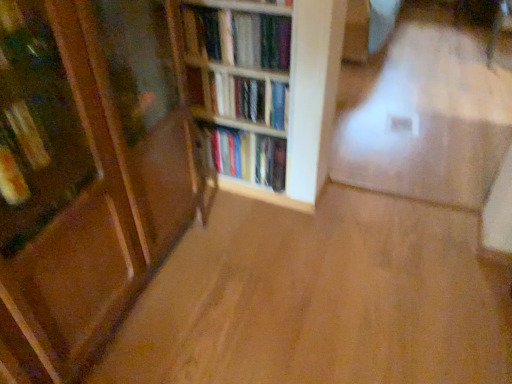
The height and width of the screenshot is (384, 512). What are the coordinates of `wooden bookshelf at center, which ranks as the first book in top-to-bottom order` in the screenshot? It's located at (238, 37).

What do you see at coordinates (267, 86) in the screenshot? The height and width of the screenshot is (384, 512). I see `wooden bookshelf at center` at bounding box center [267, 86].

Describe the element at coordinates (425, 112) in the screenshot. I see `white glossy wall at upper center` at that location.

Find the location of `wooden bookshelf at center, which ranks as the first book in top-to-bottom order`. wooden bookshelf at center, which ranks as the first book in top-to-bottom order is located at coordinates (238, 37).

Between wooden bookshelf at center, marked as the third book in a bottom-to-top arrangement, and wooden bookshelf at center, which one has larger width?

wooden bookshelf at center, marked as the third book in a bottom-to-top arrangement, is wider.

Is wooden bookshelf at center, which ranks as the first book in top-to-bottom order, smaller than wooden bookshelf at center?

Correct, wooden bookshelf at center, which ranks as the first book in top-to-bottom order, occupies less space than wooden bookshelf at center.

Is wooden bookshelf at center, marked as the third book in a bottom-to-top arrangement, facing away from wooden bookshelf at center?

Absolutely, wooden bookshelf at center, marked as the third book in a bottom-to-top arrangement, is directed away from wooden bookshelf at center.

Does point (202, 36) come behind point (185, 16)?

Yes, point (202, 36) is farther from viewer.

Based on the photo, considering the sizes of objects white glossy wall at upper center and wooden bookshelf at center, marked as the third book in a bottom-to-top arrangement, in the image provided, who is bigger, white glossy wall at upper center or wooden bookshelf at center, marked as the third book in a bottom-to-top arrangement,?

white glossy wall at upper center is bigger.

Is white glossy wall at upper center closer to the viewer compared to wooden bookshelf at center, which ranks as the first book in top-to-bottom order?

No, the depth of white glossy wall at upper center is greater than that of wooden bookshelf at center, which ranks as the first book in top-to-bottom order.

Can you confirm if white glossy wall at upper center is shorter than wooden bookshelf at center, which ranks as the first book in top-to-bottom order?

Indeed, white glossy wall at upper center has a lesser height compared to wooden bookshelf at center, which ranks as the first book in top-to-bottom order.

Is there a large distance between white glossy wall at upper center and wooden bookshelf at center, marked as the third book in a bottom-to-top arrangement?

Indeed, white glossy wall at upper center is not near wooden bookshelf at center, marked as the third book in a bottom-to-top arrangement.

Locate an element on the screen. This screenshot has height=384, width=512. book behind the hardcover books at center, the second book in the top-to-bottom sequence is located at coordinates (246, 156).

Is the depth of hardcover books at center, the second book in the top-to-bottom sequence, greater than that of hardcover books at center, the first book in the bottom-to-top sequence?

That is False.

Between hardcover books at center, the second book in the bottom-to-top sequence, and hardcover books at center, which is counted as the third book, starting from the top, which one appears on the left side from the viewer's perspective?

From the viewer's perspective, hardcover books at center, the second book in the bottom-to-top sequence, appears more on the left side.

Could hardcover books at center, which is counted as the third book, starting from the top, be considered to be inside hardcover books at center, the second book in the top-to-bottom sequence?

That's incorrect, hardcover books at center, which is counted as the third book, starting from the top, is not inside hardcover books at center, the second book in the top-to-bottom sequence.

Locate an element on the screen. Image resolution: width=512 pixels, height=384 pixels. book that is the 2nd object located in front of the hardcover books at center, the first book in the bottom-to-top sequence is located at coordinates (238, 37).

From a real-world perspective, relative to wooden bookshelf at center, which ranks as the first book in top-to-bottom order, is hardcover books at center, the first book in the bottom-to-top sequence, vertically above or below?

hardcover books at center, the first book in the bottom-to-top sequence, is situated lower than wooden bookshelf at center, which ranks as the first book in top-to-bottom order, in the real world.

Is hardcover books at center, which is counted as the third book, starting from the top, next to wooden bookshelf at center, marked as the third book in a bottom-to-top arrangement, and touching it?

No, hardcover books at center, which is counted as the third book, starting from the top, is not making contact with wooden bookshelf at center, marked as the third book in a bottom-to-top arrangement.

Starting from the wooden bookshelf at center, which book is the 2nd one behind? Please provide its 2D coordinates.

[(248, 98)]

Is wooden bookshelf at center not inside hardcover books at center, the second book in the top-to-bottom sequence?

Absolutely, wooden bookshelf at center is external to hardcover books at center, the second book in the top-to-bottom sequence.

Is wooden bookshelf at center aimed at hardcover books at center, the second book in the top-to-bottom sequence?

Yes, wooden bookshelf at center faces towards hardcover books at center, the second book in the top-to-bottom sequence.

Is point (292, 159) farther from camera compared to point (273, 127)?

That is False.

From a real-world perspective, who is located lower, wooden bookshelf at center, which ranks as the first book in top-to-bottom order, or hardcover books at center, the second book in the top-to-bottom sequence?

hardcover books at center, the second book in the top-to-bottom sequence.

Which is less distant, [215,36] or [210,94]?

The point [215,36] is closer to the camera.

Consider the image. Considering the relative positions of wooden bookshelf at center, which ranks as the first book in top-to-bottom order, and hardcover books at center, the second book in the bottom-to-top sequence, in the image provided, is wooden bookshelf at center, which ranks as the first book in top-to-bottom order, to the left or to the right of hardcover books at center, the second book in the bottom-to-top sequence,?

wooden bookshelf at center, which ranks as the first book in top-to-bottom order, is positioned on hardcover books at center, the second book in the bottom-to-top sequence,'s left side.

Which of these two, wooden bookshelf at center, which ranks as the first book in top-to-bottom order, or hardcover books at center, the second book in the bottom-to-top sequence, stands shorter?

hardcover books at center, the second book in the bottom-to-top sequence.

Is hardcover books at center, the first book in the bottom-to-top sequence, positioned with its back to white glossy wall at upper center?

Yes, hardcover books at center, the first book in the bottom-to-top sequence,'s orientation is away from white glossy wall at upper center.

Which is correct: hardcover books at center, which is counted as the third book, starting from the top, is inside white glossy wall at upper center, or outside of it?

hardcover books at center, which is counted as the third book, starting from the top, lies outside white glossy wall at upper center.

Between point (205, 129) and point (441, 69), which one is positioned in front?

The point (205, 129) is more forward.

Find the location of `corridor on the right of hardcover books at center, which is counted as the third book, starting from the top`. corridor on the right of hardcover books at center, which is counted as the third book, starting from the top is located at coordinates (425, 112).

This screenshot has width=512, height=384. Identify the location of the 1st book to the right of the wooden bookshelf at center, starting your count from the anchor. (238, 37).

Where is `the 3rd book to the left of the white glossy wall at upper center, starting your count from the anchor`? the 3rd book to the left of the white glossy wall at upper center, starting your count from the anchor is located at coordinates (238, 37).

When comparing their distances from wooden bookshelf at center, marked as the third book in a bottom-to-top arrangement, does hardcover books at center, the first book in the bottom-to-top sequence, or hardcover books at center, the second book in the bottom-to-top sequence, seem closer?

hardcover books at center, the second book in the bottom-to-top sequence, lies closer to wooden bookshelf at center, marked as the third book in a bottom-to-top arrangement, than the other object.

Looking at the image, which one is located further to white glossy wall at upper center, hardcover books at center, which is counted as the third book, starting from the top, or wooden bookshelf at center, which ranks as the first book in top-to-bottom order?

Among the two, wooden bookshelf at center, which ranks as the first book in top-to-bottom order, is located further to white glossy wall at upper center.

Considering their positions, is hardcover books at center, which is counted as the third book, starting from the top, positioned further to hardcover books at center, the second book in the top-to-bottom sequence, than wooden bookshelf at center, marked as the third book in a bottom-to-top arrangement?

hardcover books at center, which is counted as the third book, starting from the top, is positioned further to the anchor hardcover books at center, the second book in the top-to-bottom sequence.

Based on their spatial positions, is hardcover books at center, which is counted as the third book, starting from the top, or wooden bookshelf at center, marked as the third book in a bottom-to-top arrangement, closer to wooden bookshelf at center?

The object closer to wooden bookshelf at center is wooden bookshelf at center, marked as the third book in a bottom-to-top arrangement.

Considering their positions, is white glossy wall at upper center positioned further to hardcover books at center, which is counted as the third book, starting from the top, than hardcover books at center, the second book in the top-to-bottom sequence?

Based on the image, white glossy wall at upper center appears to be further to hardcover books at center, which is counted as the third book, starting from the top.

Considering their positions, is white glossy wall at upper center positioned closer to hardcover books at center, the second book in the top-to-bottom sequence, than hardcover books at center, the first book in the bottom-to-top sequence?

hardcover books at center, the first book in the bottom-to-top sequence.

Which object lies nearer to the anchor point wooden bookshelf at center, hardcover books at center, which is counted as the third book, starting from the top, or hardcover books at center, the second book in the bottom-to-top sequence?

hardcover books at center, the second book in the bottom-to-top sequence.

Considering their positions, is hardcover books at center, the first book in the bottom-to-top sequence, positioned further to white glossy wall at upper center than hardcover books at center, the second book in the bottom-to-top sequence?

hardcover books at center, the second book in the bottom-to-top sequence, is further to white glossy wall at upper center.

What are the coordinates of `shelf between wooden bookshelf at center, which ranks as the first book in top-to-bottom order, and hardcover books at center, which is counted as the third book, starting from the top, from top to bottom` in the screenshot? It's located at (267, 86).

Where is `book between wooden bookshelf at center, which ranks as the first book in top-to-bottom order, and hardcover books at center, which is counted as the third book, starting from the top, vertically`? The image size is (512, 384). book between wooden bookshelf at center, which ranks as the first book in top-to-bottom order, and hardcover books at center, which is counted as the third book, starting from the top, vertically is located at coordinates (248, 98).

This screenshot has height=384, width=512. What are the coordinates of `book between hardcover books at center, the second book in the bottom-to-top sequence, and white glossy wall at upper center, in the horizontal direction` in the screenshot? It's located at (246, 156).

Where is `book between wooden bookshelf at center, which ranks as the first book in top-to-bottom order, and wooden bookshelf at center vertically`? book between wooden bookshelf at center, which ranks as the first book in top-to-bottom order, and wooden bookshelf at center vertically is located at coordinates (248, 98).